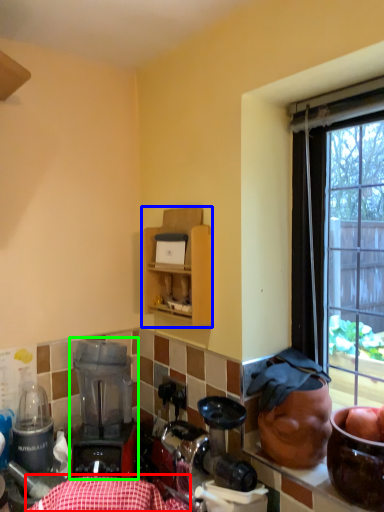
Question: Based on their relative distances, which object is nearer to tablecloth (highlighted by a red box)? Choose from cabinetry (highlighted by a blue box) and blender (highlighted by a green box).

Choices:
 (A) cabinetry
 (B) blender

Answer: (B)